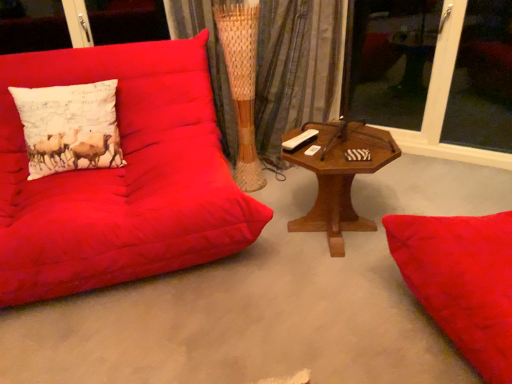
Question: Is there a large distance between transparent glass window at upper right, the 1th window screen when ordered from left to right, and woodenobject at center?

Choices:
 (A) yes
 (B) no

Answer: (A)

Question: From the image's perspective, is transparent glass window at upper right, the 1th window screen when ordered from left to right, over woodenobject at center?

Choices:
 (A) no
 (B) yes

Answer: (B)

Question: From the image's perspective, does transparent glass window at upper right, marked as the 2th window screen in a right-to-left arrangement, appear lower than woodenobject at center?

Choices:
 (A) no
 (B) yes

Answer: (A)

Question: Could you tell me if transparent glass window at upper right, marked as the 2th window screen in a right-to-left arrangement, is turned towards woodenobject at center?

Choices:
 (A) no
 (B) yes

Answer: (B)

Question: Considering the relative sizes of transparent glass window at upper right, the 1th window screen when ordered from left to right, and woodenobject at center in the image provided, is transparent glass window at upper right, the 1th window screen when ordered from left to right, thinner than woodenobject at center?

Choices:
 (A) no
 (B) yes

Answer: (B)

Question: From a real-world perspective, is woven fabric curtain at center physically located above or below white printed cushion at left?

Choices:
 (A) above
 (B) below

Answer: (B)

Question: Considering the positions of woven fabric curtain at center and white printed cushion at left in the image, is woven fabric curtain at center bigger or smaller than white printed cushion at left?

Choices:
 (A) big
 (B) small

Answer: (A)

Question: Visually, is woven fabric curtain at center positioned to the left or to the right of white printed cushion at left?

Choices:
 (A) left
 (B) right

Answer: (B)

Question: Is woven fabric curtain at center inside or outside of white printed cushion at left?

Choices:
 (A) inside
 (B) outside

Answer: (B)

Question: Considering the positions of transparent glass window at upper right, which ranks as the 1th window screen in right-to-left order, and white printed cushion at left in the image, is transparent glass window at upper right, which ranks as the 1th window screen in right-to-left order, taller or shorter than white printed cushion at left?

Choices:
 (A) short
 (B) tall

Answer: (B)

Question: Looking at their shapes, would you say transparent glass window at upper right, which ranks as the 1th window screen in right-to-left order, is wider or thinner than white printed cushion at left?

Choices:
 (A) wide
 (B) thin

Answer: (B)

Question: Is point (487, 23) closer or farther from the camera than point (32, 153)?

Choices:
 (A) closer
 (B) farther

Answer: (B)

Question: From the image's perspective, is transparent glass window at upper right, which ranks as the 1th window screen in right-to-left order, above or below white printed cushion at left?

Choices:
 (A) below
 (B) above

Answer: (B)

Question: From a real-world perspective, is white printed cushion at left positioned above or below transparent glass window at upper right, marked as the 2th window screen in a right-to-left arrangement?

Choices:
 (A) above
 (B) below

Answer: (A)

Question: Visually, is white printed cushion at left positioned to the left or to the right of transparent glass window at upper right, marked as the 2th window screen in a right-to-left arrangement?

Choices:
 (A) right
 (B) left

Answer: (B)